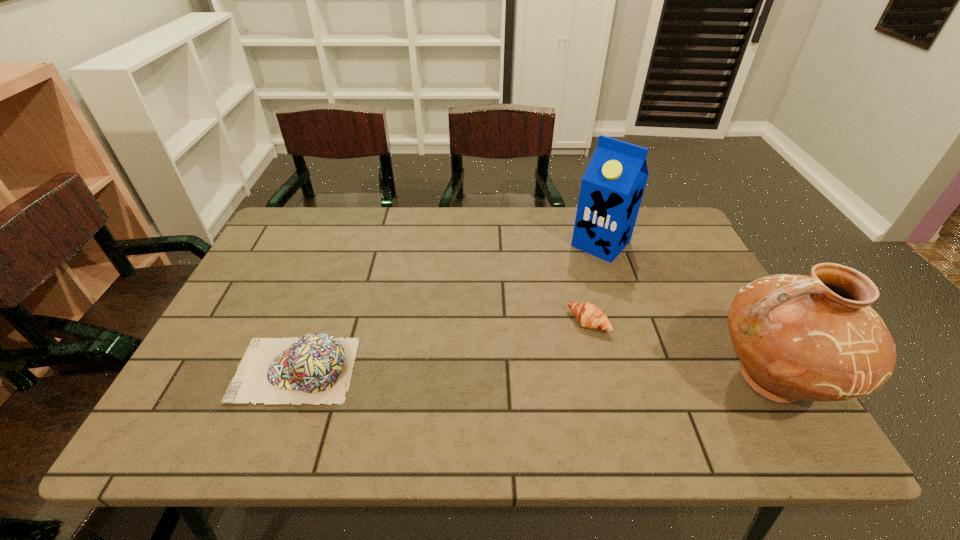
Where is `vacant space located 0.370m with the cap open on the farthest object`? vacant space located 0.370m with the cap open on the farthest object is located at coordinates (515, 335).

This screenshot has width=960, height=540. Find the location of `vacant point located 0.100m with the cap open on the farthest object`. vacant point located 0.100m with the cap open on the farthest object is located at coordinates (569, 277).

At what (x,y) coordinates should I click in order to perform the action: click on vacant space located 0.180m on the front-facing side of the pastry. Please return your answer as a coordinate pair (x, y). Looking at the image, I should click on (531, 377).

Locate an element on the screen. The height and width of the screenshot is (540, 960). vacant space situated on the front-facing side of the pastry is located at coordinates (547, 361).

Locate an element on the screen. vacant space located on the front-facing side of the pastry is located at coordinates (558, 352).

This screenshot has height=540, width=960. Find the location of `object that is at the far edge`. object that is at the far edge is located at coordinates (612, 188).

The height and width of the screenshot is (540, 960). Identify the location of cap that is at the near edge. (317, 368).

Find the location of a particular element. This screenshot has height=540, width=960. pottery that is at the near edge is located at coordinates (817, 338).

Find the location of `object positioned at the left edge`. object positioned at the left edge is located at coordinates (317, 368).

Find the location of a particular element. Image resolution: width=960 pixels, height=540 pixels. object present at the right edge is located at coordinates (817, 338).